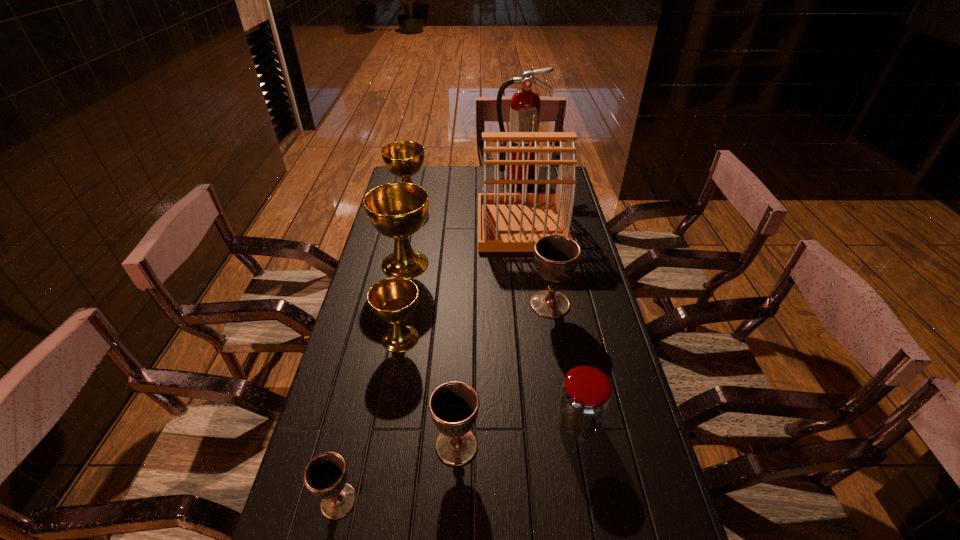
You are a GUI agent. You are given a task and a screenshot of the screen. Output one action in this format:
    pyautogui.click(x=<x>, y=<y>)
    Task: Click on the second chalice from right to left
    The width and height of the screenshot is (960, 540).
    Given the screenshot: What is the action you would take?
    pyautogui.click(x=453, y=406)

This screenshot has height=540, width=960. Find the location of `the smallest gold chalice`. the smallest gold chalice is located at coordinates (393, 300).

The width and height of the screenshot is (960, 540). I want to click on the nearest gold chalice, so click(393, 300).

Image resolution: width=960 pixels, height=540 pixels. Identify the location of red jar. (585, 396).

Image resolution: width=960 pixels, height=540 pixels. Identify the location of the nearest brown chalice. tap(325, 475).

Where is `the leftmost brown chalice`? the leftmost brown chalice is located at coordinates (325, 475).

This screenshot has height=540, width=960. What are the coordinates of `free space located on the nozzle side of the fire extinguisher` in the screenshot? It's located at (526, 219).

Where is `free location located 0.080m with an open door on the beige birdcage`? The image size is (960, 540). free location located 0.080m with an open door on the beige birdcage is located at coordinates (458, 225).

The width and height of the screenshot is (960, 540). I want to click on vacant region located with an open door on the beige birdcage, so click(x=455, y=225).

Identify the location of vacant space located with an open door on the beige birdcage. (438, 225).